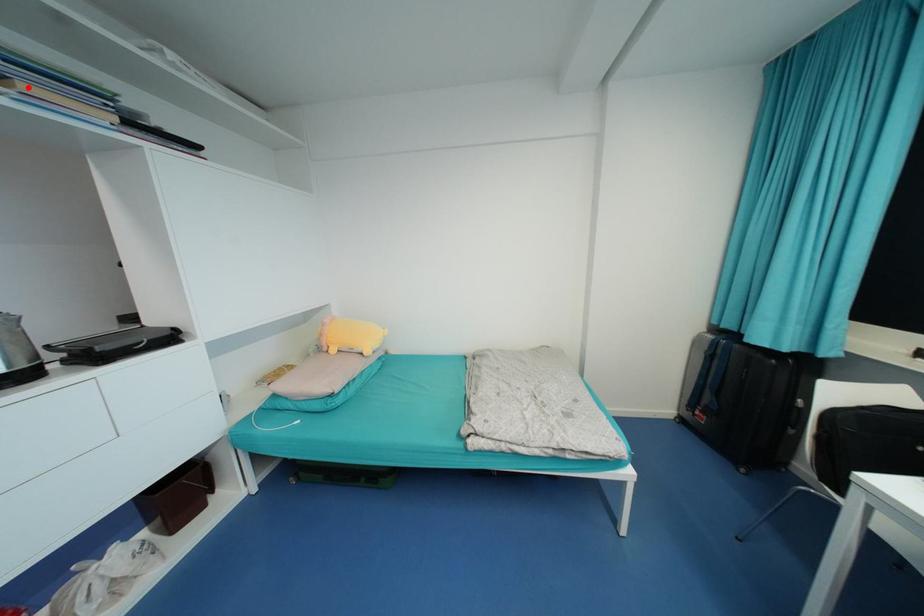
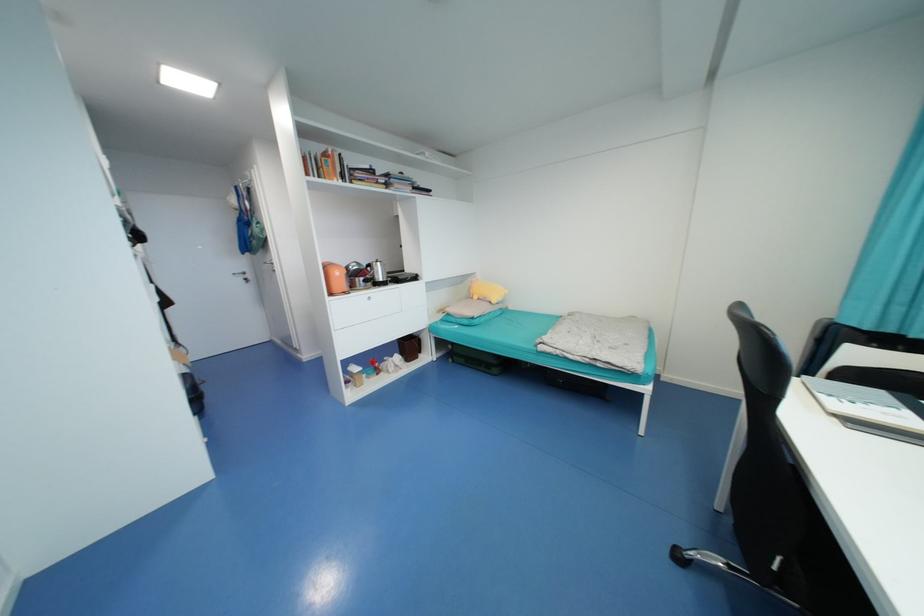
Locate, in the second image, the point that corresponds to the highlighted location in the first image.

(399, 187)